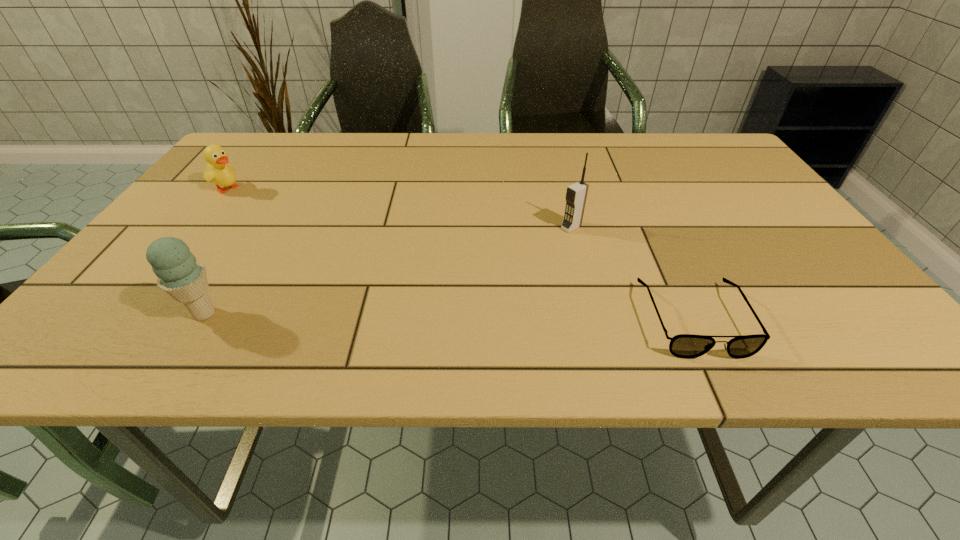
You are a GUI agent. You are given a task and a screenshot of the screen. Output one action in this format:
    pyautogui.click(x=<x>, y=<y>)
    Task: Click on the unoccupied position between the farthest object and the second object from right to left
    This screenshot has width=960, height=540.
    Given the screenshot: What is the action you would take?
    pyautogui.click(x=400, y=207)

The height and width of the screenshot is (540, 960). In order to click on vacant space that is in between the third object from left to right and the spectacles in this screenshot , I will do `click(633, 273)`.

Identify the location of the third closest object relative to the third tallest object. The width and height of the screenshot is (960, 540). (687, 346).

The width and height of the screenshot is (960, 540). Identify the location of object identified as the closest to the leftmost object. (179, 274).